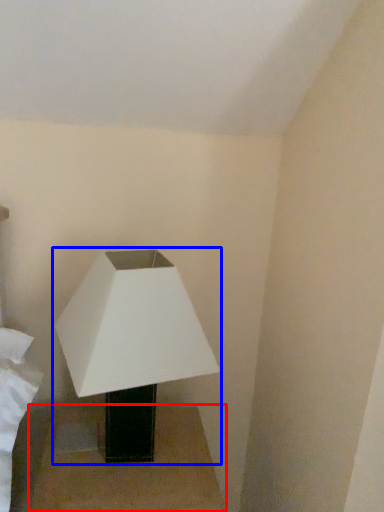
Question: Which point is closer to the camera, table (highlighted by a red box) or lamp (highlighted by a blue box)?

Choices:
 (A) table
 (B) lamp

Answer: (B)